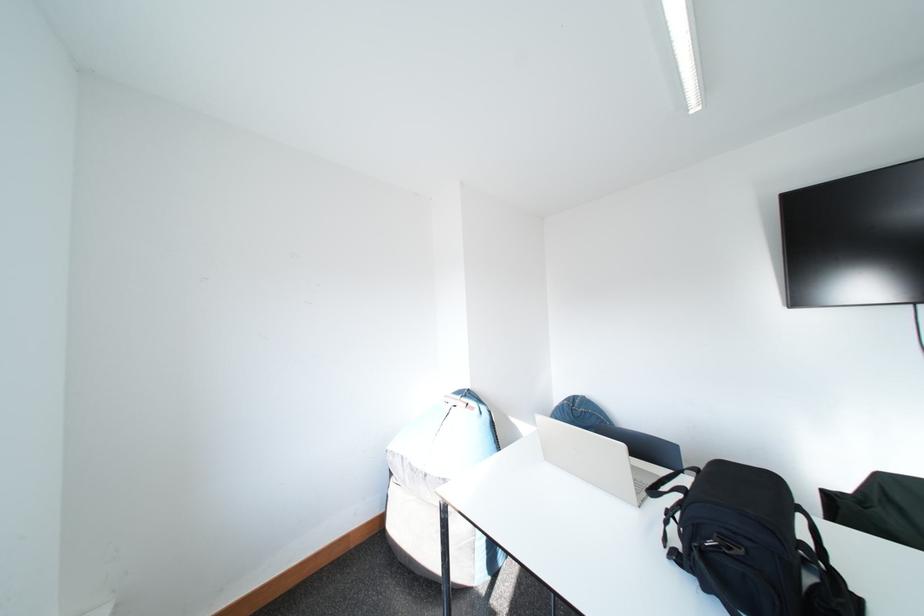
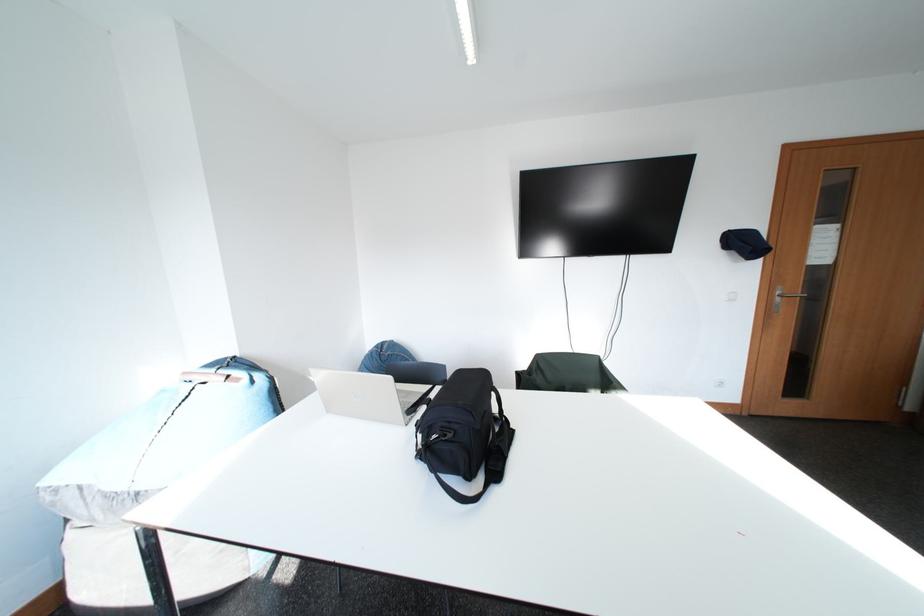
Question: The images are taken continuously from a first-person perspective. In which direction is your viewpoint rotating?

Choices:
 (A) Left
 (B) Right
 (C) Up
 (D) Down

Answer: (B)